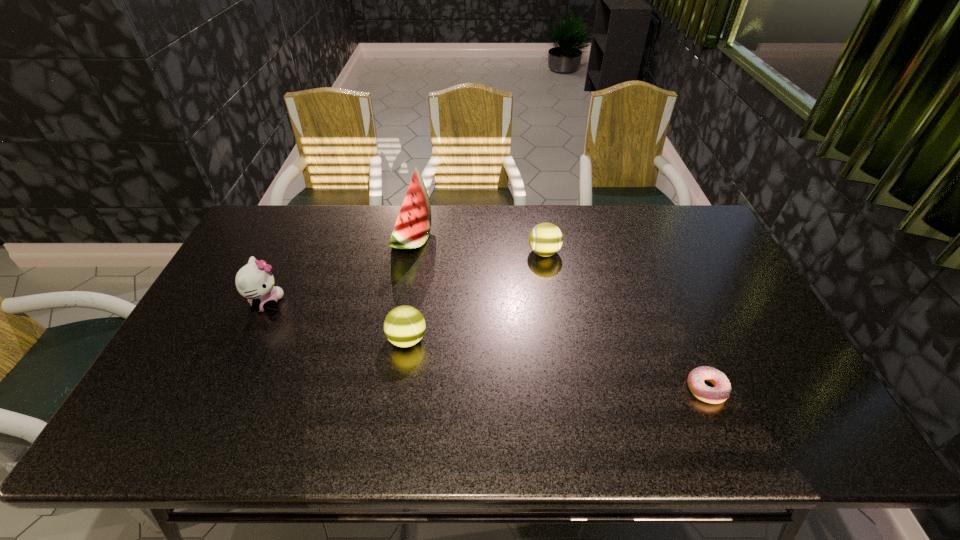
This screenshot has height=540, width=960. I want to click on free space located 0.280m on the front-facing side of the kitten, so click(x=380, y=304).

I want to click on free space located on the left of the farther tennis ball, so click(x=488, y=253).

I want to click on vacant position located on the left of the nearer tennis ball, so click(294, 339).

What are the coordinates of `free space located 0.170m on the back of the rightmost object` in the screenshot? It's located at (678, 321).

The height and width of the screenshot is (540, 960). Find the location of `watermelon that is at the far edge`. watermelon that is at the far edge is located at coordinates click(x=412, y=228).

What are the coordinates of `tennis ball at the far edge` in the screenshot? It's located at (545, 239).

Identify the location of object that is at the left edge. The height and width of the screenshot is (540, 960). (254, 281).

In the image, there is a desktop. Where is `vacant region at the far edge`? The width and height of the screenshot is (960, 540). vacant region at the far edge is located at coordinates (346, 230).

You are a GUI agent. You are given a task and a screenshot of the screen. Output one action in this format:
    pyautogui.click(x=<x>, y=<y>)
    Task: Click on the vacant space at the near edge of the desktop
    This screenshot has width=960, height=540.
    Given the screenshot: What is the action you would take?
    pyautogui.click(x=567, y=438)

Locate an element on the screen. The width and height of the screenshot is (960, 540). vacant area at the left edge is located at coordinates pyautogui.click(x=241, y=298).